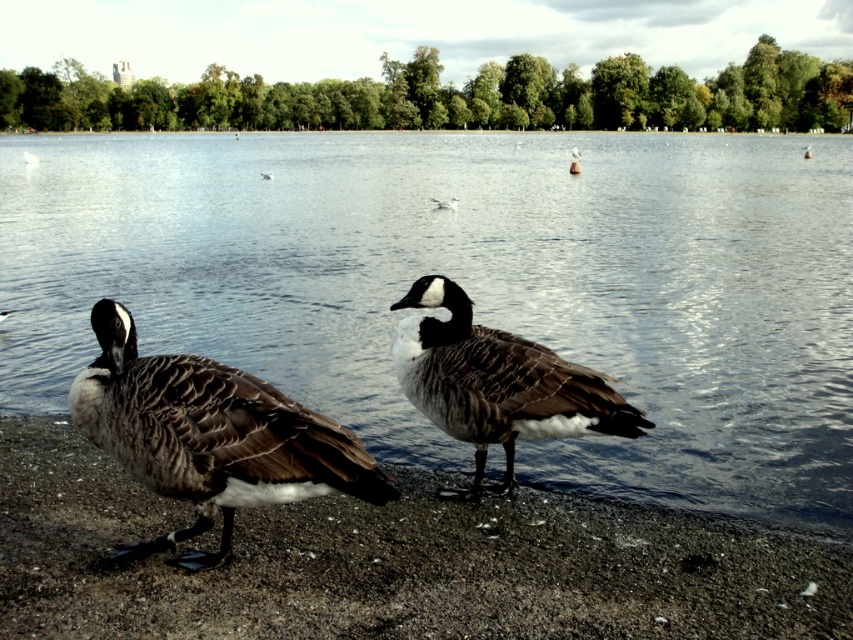
In the scene shown: Is brown feathered duck at center below white feathered duck at center?

Yes, brown feathered duck at center is below white feathered duck at center.

Is point (387, 497) behind point (445, 205)?

That is False.

I want to click on brown feathered duck at center, so click(x=209, y=436).

Can you confirm if smooth sand shoreline at lower center is wider than brown feathered duck at center?

Correct, the width of smooth sand shoreline at lower center exceeds that of brown feathered duck at center.

Who is positioned more to the left, smooth sand shoreline at lower center or brown feathered duck at center?

Positioned to the left is brown feathered duck at center.

Measure the distance between point [497,630] and camera.

Point [497,630] is 9.71 feet from camera.

Locate an element on the screen. Image resolution: width=853 pixels, height=640 pixels. smooth sand shoreline at lower center is located at coordinates (392, 563).

Can you confirm if dark brown feathered duck at center is positioned below white feathered bird at center?

Yes.

Looking at this image, between dark brown feathered duck at center and white feathered bird at center, which one has more height?

With more height is white feathered bird at center.

Is point (515, 371) positioned behind point (33, 156)?

No, it is in front of (33, 156).

You are a GUI agent. You are given a task and a screenshot of the screen. Output one action in this format:
    pyautogui.click(x=<x>, y=<y>)
    Task: Click on the dark brown feathered duck at center
    The height and width of the screenshot is (640, 853).
    Given the screenshot: What is the action you would take?
    pyautogui.click(x=497, y=381)